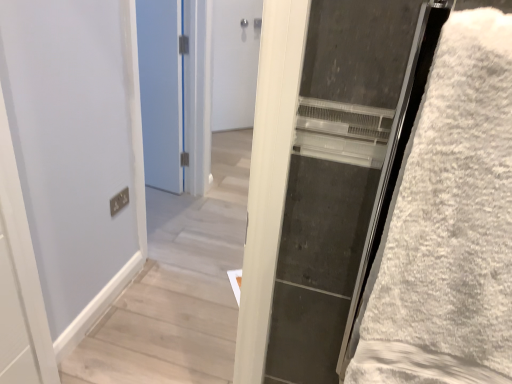
Question: Should I look upward or downward to see blue painted door at upper left, marked as the first door in a left-to-right arrangement?

Choices:
 (A) up
 (B) down

Answer: (A)

Question: Is white fluffy bath towel at right bigger than blue painted door at upper left, the second door from the right?

Choices:
 (A) yes
 (B) no

Answer: (A)

Question: From a real-world perspective, does white fluffy bath towel at right stand above blue painted door at upper left, marked as the first door in a left-to-right arrangement?

Choices:
 (A) no
 (B) yes

Answer: (B)

Question: Considering the relative positions of white fluffy bath towel at right and blue painted door at upper left, the first door positioned from the front, in the image provided, is white fluffy bath towel at right to the left of blue painted door at upper left, the first door positioned from the front, from the viewer's perspective?

Choices:
 (A) no
 (B) yes

Answer: (A)

Question: Is white fluffy bath towel at right to the right of blue painted door at upper left, marked as the first door in a left-to-right arrangement, from the viewer's perspective?

Choices:
 (A) no
 (B) yes

Answer: (B)

Question: Is white fluffy bath towel at right shorter than blue painted door at upper left, placed as the 2th door when sorted from back to front?

Choices:
 (A) no
 (B) yes

Answer: (B)

Question: Is white fluffy bath towel at right taller than blue painted door at upper left, the first door positioned from the front?

Choices:
 (A) yes
 (B) no

Answer: (B)

Question: Does blue painted door at upper left, marked as the first door in a left-to-right arrangement, have a greater width compared to white fluffy bath towel at right?

Choices:
 (A) no
 (B) yes

Answer: (A)

Question: Is blue painted door at upper left, the first door positioned from the front, smaller than white fluffy bath towel at right?

Choices:
 (A) no
 (B) yes

Answer: (B)

Question: Can you confirm if blue painted door at upper left, placed as the 2th door when sorted from back to front, is shorter than white fluffy bath towel at right?

Choices:
 (A) yes
 (B) no

Answer: (B)

Question: Is blue painted door at upper left, placed as the 2th door when sorted from back to front, oriented away from white fluffy bath towel at right?

Choices:
 (A) no
 (B) yes

Answer: (A)

Question: Does blue painted door at upper left, placed as the 2th door when sorted from back to front, have a larger size compared to white fluffy bath towel at right?

Choices:
 (A) yes
 (B) no

Answer: (B)

Question: Considering the relative positions of blue painted door at upper left, the second door from the right, and white fluffy bath towel at right in the image provided, is blue painted door at upper left, the second door from the right, to the left of white fluffy bath towel at right from the viewer's perspective?

Choices:
 (A) no
 (B) yes

Answer: (B)

Question: Is white fluffy bath towel at right at the right side of white matte door at center, which ranks as the first door in right-to-left order?

Choices:
 (A) no
 (B) yes

Answer: (B)